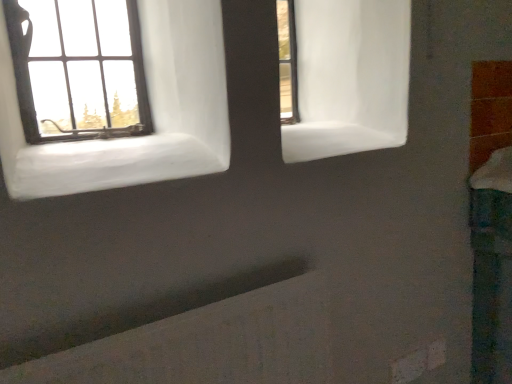
Where is `vacant area that is in front of matte black window at upper left`? vacant area that is in front of matte black window at upper left is located at coordinates (62, 141).